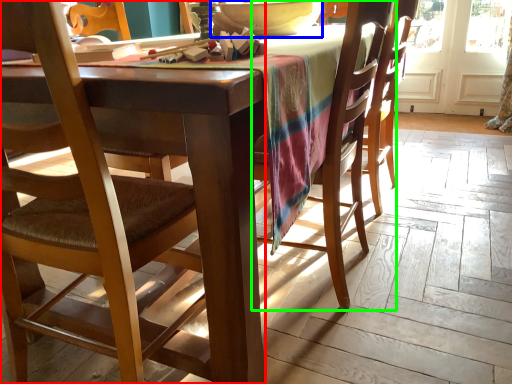
Question: Based on their relative distances, which object is nearer to chair (highlighted by a red box)? Choose from bowl (highlighted by a blue box) and chair (highlighted by a green box).

Choices:
 (A) bowl
 (B) chair

Answer: (B)